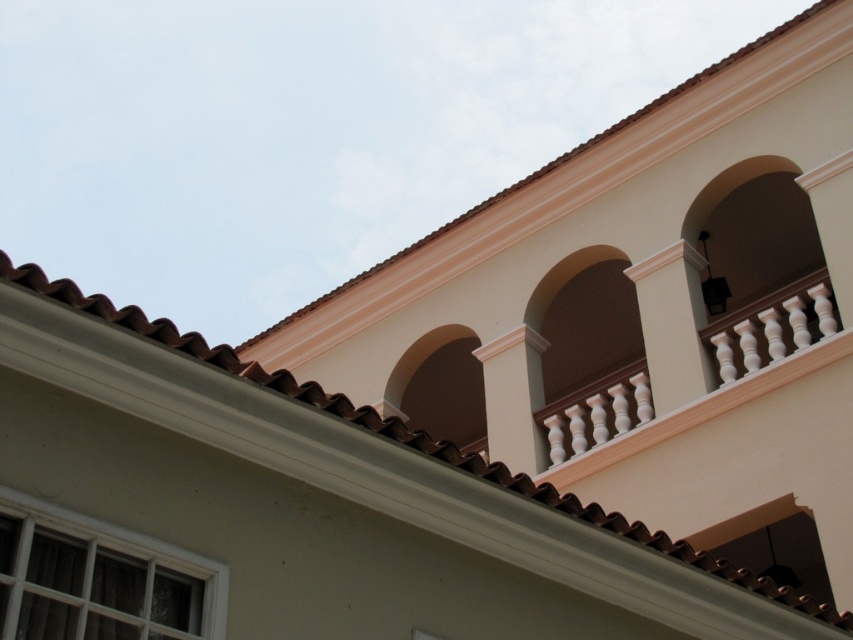
Question: Which of the following is the closest to the observer?

Choices:
 (A) (643, 259)
 (B) (543, 340)

Answer: (A)

Question: Is white smooth pillar at upper center closer to the viewer compared to white glossy column at upper center?

Choices:
 (A) no
 (B) yes

Answer: (B)

Question: Can you confirm if white smooth pillar at upper center is positioned to the right of white glossy column at upper center?

Choices:
 (A) no
 (B) yes

Answer: (B)

Question: Which of the following is the closest to the observer?

Choices:
 (A) white smooth pillar at upper center
 (B) white glossy column at upper center

Answer: (A)

Question: Can you confirm if white smooth pillar at upper center is wider than white glossy column at upper center?

Choices:
 (A) no
 (B) yes

Answer: (B)